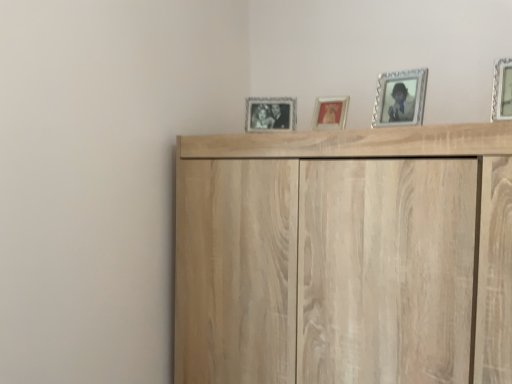
Question: Is silver textured picture frame at upper right, acting as the second picture frame starting from the front, completely or partially outside of silver metallic picture frame at upper right, which ranks as the first picture frame in right-to-left order?

Choices:
 (A) no
 (B) yes

Answer: (B)

Question: Could you tell me if silver textured picture frame at upper right, acting as the second picture frame starting from the front, is turned towards silver metallic picture frame at upper right, which ranks as the first picture frame in right-to-left order?

Choices:
 (A) no
 (B) yes

Answer: (A)

Question: Considering the relative positions of silver textured picture frame at upper right, which is the second picture frame in right-to-left order, and silver metallic picture frame at upper right, which is counted as the 1th picture frame, starting from the front, in the image provided, is silver textured picture frame at upper right, which is the second picture frame in right-to-left order, to the left of silver metallic picture frame at upper right, which is counted as the 1th picture frame, starting from the front, from the viewer's perspective?

Choices:
 (A) no
 (B) yes

Answer: (B)

Question: From the image's perspective, does silver textured picture frame at upper right, marked as the third picture frame in a left-to-right arrangement, appear lower than silver metallic picture frame at upper right, which ranks as the first picture frame in right-to-left order?

Choices:
 (A) no
 (B) yes

Answer: (B)

Question: From a real-world perspective, is silver textured picture frame at upper right, which is counted as the 3th picture frame, starting from the back, located higher than silver metallic picture frame at upper right, which ranks as the first picture frame in right-to-left order?

Choices:
 (A) yes
 (B) no

Answer: (B)

Question: Does silver textured picture frame at upper right, which is counted as the 3th picture frame, starting from the back, have a lesser width compared to silver metallic picture frame at upper right, the 4th picture frame from the back?

Choices:
 (A) no
 (B) yes

Answer: (B)

Question: Considering the relative sizes of black and white photo frame at center, the first picture frame positioned from the left, and metallic silver picture frame at center, the third picture frame positioned from the right, in the image provided, is black and white photo frame at center, the first picture frame positioned from the left, smaller than metallic silver picture frame at center, the third picture frame positioned from the right,?

Choices:
 (A) yes
 (B) no

Answer: (B)

Question: Is black and white photo frame at center, the first picture frame positioned from the left, aimed at metallic silver picture frame at center, the 3th picture frame from the front?

Choices:
 (A) no
 (B) yes

Answer: (A)

Question: Is black and white photo frame at center, arranged as the first picture frame when viewed from the back, positioned behind metallic silver picture frame at center, which is the 2th picture frame from left to right?

Choices:
 (A) no
 (B) yes

Answer: (B)

Question: Can you see black and white photo frame at center, the first picture frame positioned from the left, touching metallic silver picture frame at center, the 3th picture frame from the front?

Choices:
 (A) yes
 (B) no

Answer: (B)

Question: Does black and white photo frame at center, arranged as the first picture frame when viewed from the back, come in front of metallic silver picture frame at center, the third picture frame positioned from the right?

Choices:
 (A) no
 (B) yes

Answer: (A)

Question: From the image's perspective, is black and white photo frame at center, the 4th picture frame viewed from the front, over metallic silver picture frame at center, the 3th picture frame from the front?

Choices:
 (A) yes
 (B) no

Answer: (A)

Question: Is light wood cupboard at upper center taller than silver textured picture frame at upper right, acting as the second picture frame starting from the front?

Choices:
 (A) no
 (B) yes

Answer: (B)